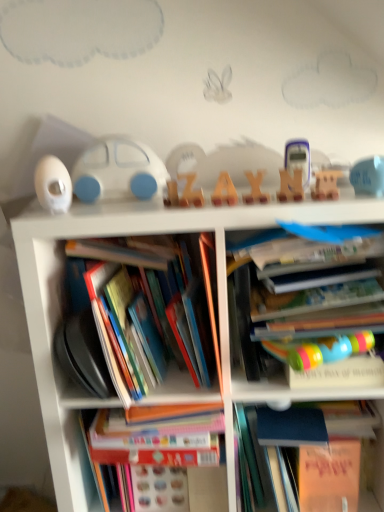
Question: Based on their positions, is wooden letter at center, the second toy from the right, located to the left or right of blue matte book at right, positioned as the 4th book in left-to-right order?

Choices:
 (A) left
 (B) right

Answer: (A)

Question: From the image's perspective, relative to blue matte book at right, positioned as the 4th book in left-to-right order, is wooden letter at center, the second toy from the right, above or below?

Choices:
 (A) above
 (B) below

Answer: (A)

Question: Which of these objects is positioned farthest from the wooden letter at center, acting as the fourth toy starting from the left?

Choices:
 (A) hardcover book at left, which appears as the first book when viewed from the left
 (B) blue rubber duck at upper right, the 5th toy when ordered from left to right
 (C) white matte car at left, marked as the fifth toy in a right-to-left arrangement
 (D) white matte toy car at center
 (E) translucent plastic calculator at center, positioned as the 3th toy in left-to-right order

Answer: (C)

Question: Which of these objects is positioned closest to the blue rubber duck at upper right, the 5th toy when ordered from left to right?

Choices:
 (A) wooden letter at center, which ranks as the 2th toy in left-to-right order
 (B) white plastic bookcase at center
 (C) blue matte book at right, which appears as the 1th book when viewed from the right
 (D) white matte car at left, marked as the fifth toy in a right-to-left arrangement
 (E) translucent plastic calculator at center, which is counted as the 3th toy, starting from the right

Answer: (E)